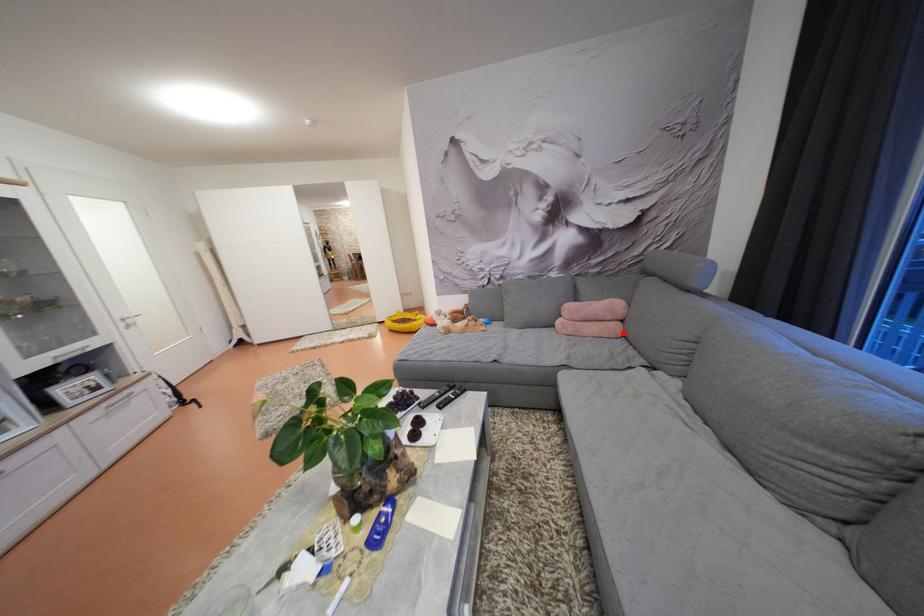
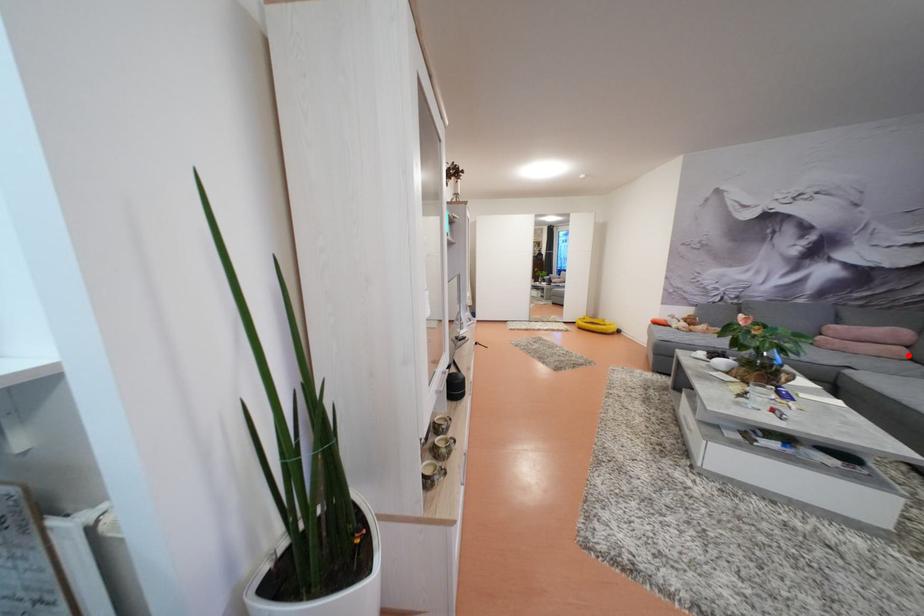
I am providing you with two images of the same scene from different viewpoints. A red point is marked on the first image and another point is marked on the second image. Do the highlighted points in image1 and image2 indicate the same real-world spot?

Yes